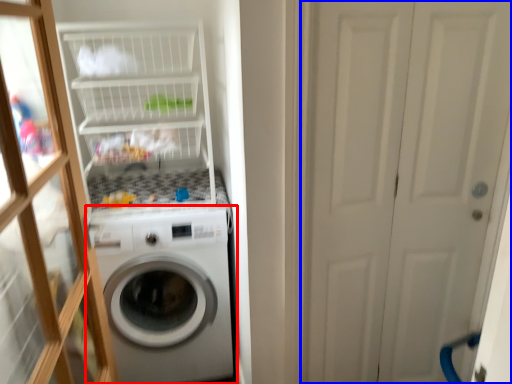
Question: Which of the following is the farthest to the observer, washing machine (highlighted by a red box) or screen door (highlighted by a blue box)?

Choices:
 (A) washing machine
 (B) screen door

Answer: (A)